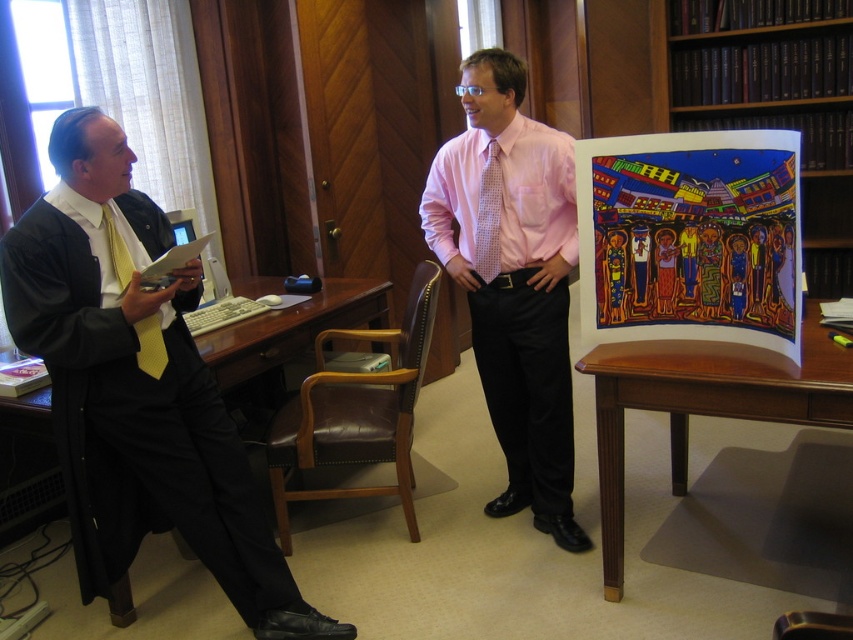
How much distance is there between matte black suit at left and pink satin shirt at center?

matte black suit at left and pink satin shirt at center are 3.53 feet apart from each other.

Does point (80, 134) come closer to viewer compared to point (450, 170)?

Yes, it is.

In the scene shown: Measure the distance between matte black suit at left and camera.

The distance of matte black suit at left from camera is 1.85 meters.

The height and width of the screenshot is (640, 853). Find the location of `matte black suit at left`. matte black suit at left is located at coordinates (136, 387).

Which is more to the left, matte black suit at left or pink textured dress shirt at center?

matte black suit at left

From the picture: Which is above, matte black suit at left or pink textured dress shirt at center?

pink textured dress shirt at center is above.

Is point (196, 394) closer to viewer compared to point (555, 221)?

Yes, it is.

This screenshot has height=640, width=853. In order to click on matte black suit at left in this screenshot , I will do `click(136, 387)`.

Which is more to the right, matte black suit at left or pink dotted tie at center?

From the viewer's perspective, pink dotted tie at center appears more on the right side.

Who is higher up, matte black suit at left or pink dotted tie at center?

pink dotted tie at center is higher up.

Which is behind, point (135, 483) or point (498, 205)?

Point (498, 205)

The width and height of the screenshot is (853, 640). I want to click on matte black suit at left, so click(136, 387).